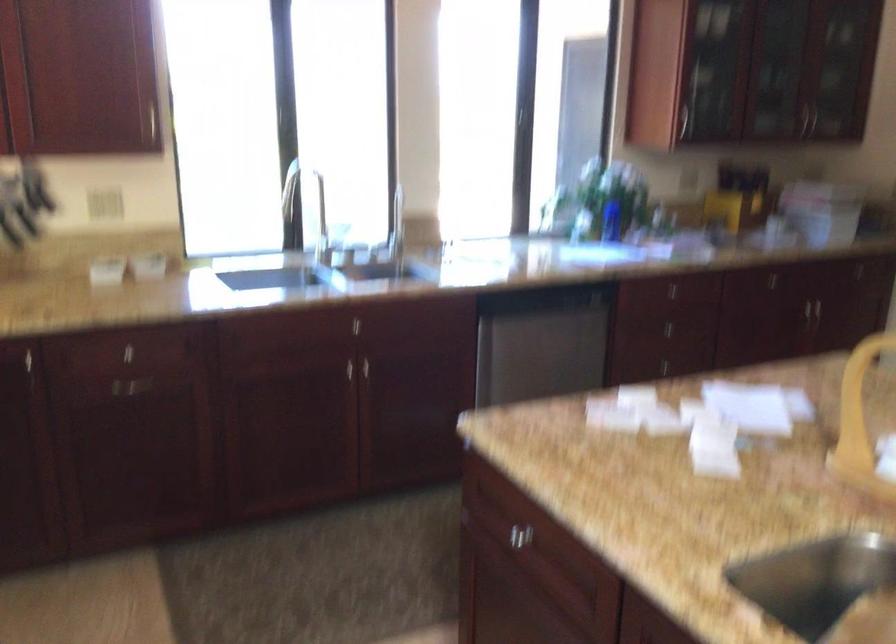
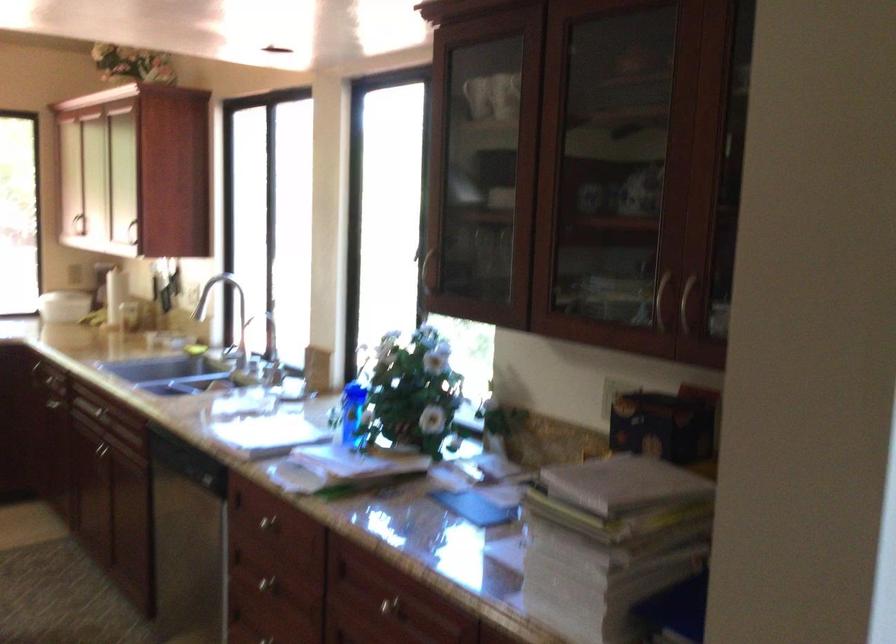
The point at (790,269) is marked in the first image. Where is the corresponding point in the second image?

(386, 605)